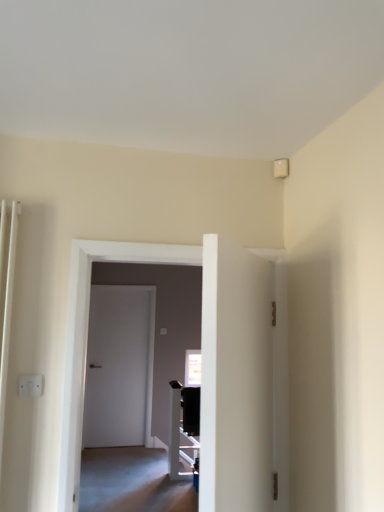
Where is `vacant space in black glossy tv at center (from a real-world perspective)`? The image size is (384, 512). vacant space in black glossy tv at center (from a real-world perspective) is located at coordinates (177, 475).